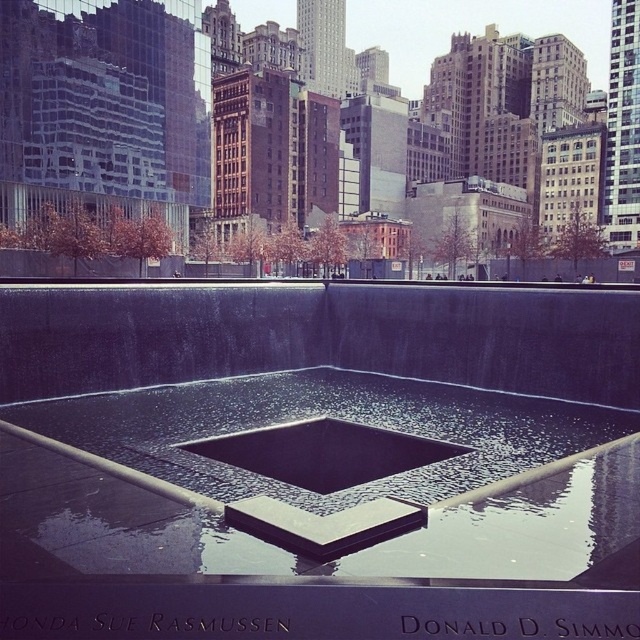
Question: Which point is closer to the camera taking this photo?

Choices:
 (A) (333, 305)
 (B) (307, 433)

Answer: (B)

Question: Observing the image, what is the correct spatial positioning of black polished concrete water at center in reference to black textured water at center?

Choices:
 (A) above
 (B) below

Answer: (A)

Question: Observing the image, what is the correct spatial positioning of black polished concrete water at center in reference to black textured water at center?

Choices:
 (A) left
 (B) right

Answer: (A)

Question: In this image, where is black polished concrete water at center located relative to black textured water at center?

Choices:
 (A) above
 (B) below

Answer: (A)

Question: Which point is closer to the camera?

Choices:
 (A) black textured water at center
 (B) black polished concrete water at center

Answer: (B)

Question: Which of the following is the closest to the observer?

Choices:
 (A) (397, 468)
 (B) (360, 349)

Answer: (A)